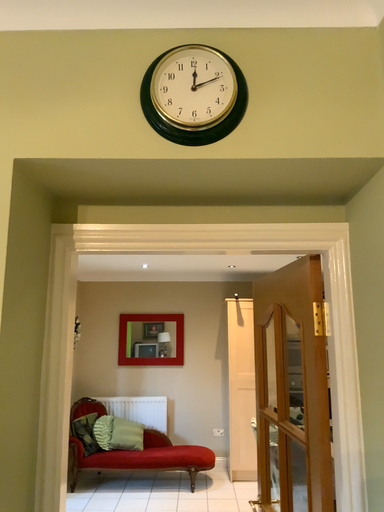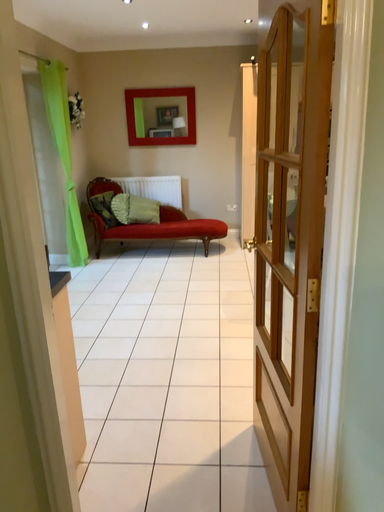
Question: How did the camera likely rotate when shooting the video?

Choices:
 (A) rotated upward
 (B) rotated downward

Answer: (B)